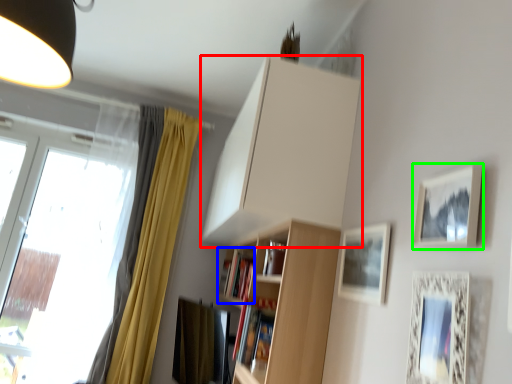
Question: Which object is the closest to the cabinetry (highlighted by a red box)? Choose among these: book (highlighted by a blue box) or picture frame (highlighted by a green box).

Choices:
 (A) book
 (B) picture frame

Answer: (A)